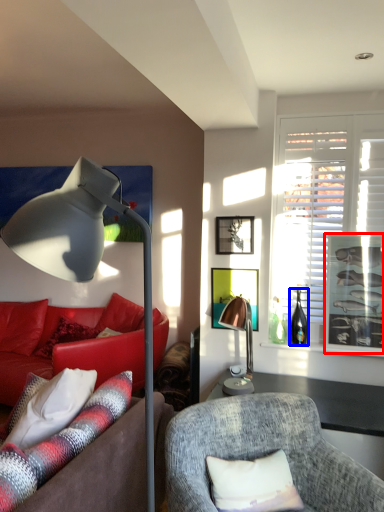
Question: Which point is closer to the camera, picture frame (highlighted by a red box) or bottle (highlighted by a blue box)?

Choices:
 (A) picture frame
 (B) bottle

Answer: (A)